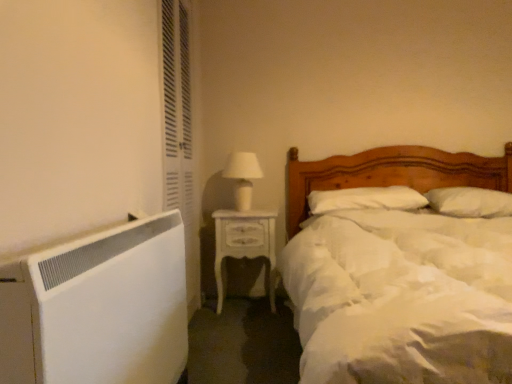
Question: Is white matte wood bed at center inside the boundaries of white soft pillow at upper right, acting as the 1th pillow starting from the right, or outside?

Choices:
 (A) inside
 (B) outside

Answer: (B)

Question: In terms of width, does white matte wood bed at center look wider or thinner when compared to white soft pillow at upper right, the 2th pillow in the left-to-right sequence?

Choices:
 (A) thin
 (B) wide

Answer: (B)

Question: Which object is the farthest from the white soft pillow at upper right, the 2th pillow in the left-to-right sequence?

Choices:
 (A) white glossy table lamp at upper center
 (B) white matte wood bed at center
 (C) white glossy nightstand at center
 (D) white textured screen door at left
 (E) white soft pillow at center, which is the 1th pillow in left-to-right order

Answer: (D)

Question: Considering the real-world distances, which object is closest to the white matte wood bed at center?

Choices:
 (A) white glossy nightstand at center
 (B) white soft pillow at center, marked as the second pillow in a right-to-left arrangement
 (C) white textured screen door at left
 (D) white glossy table lamp at upper center
 (E) white soft pillow at upper right, the 2th pillow in the left-to-right sequence

Answer: (B)